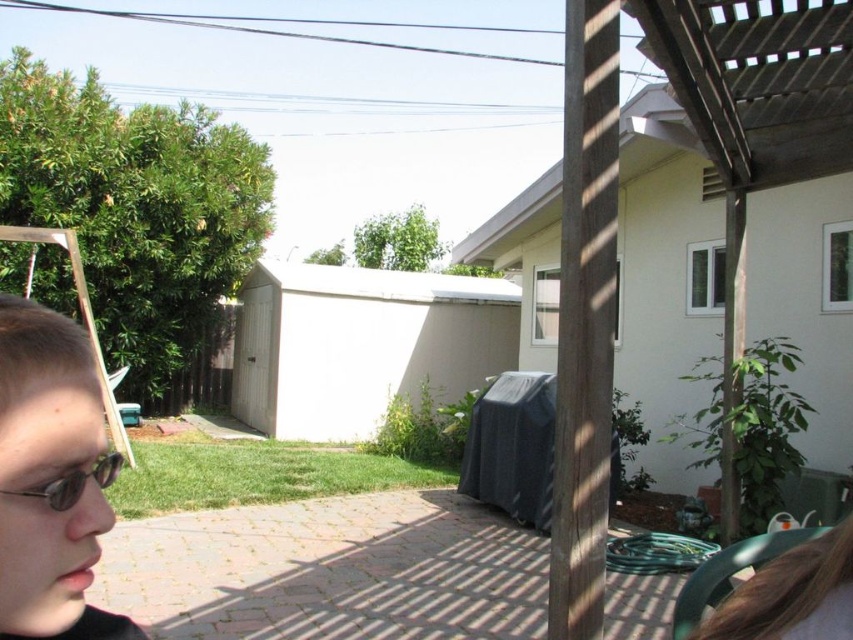
You are standing on the paved patio and want to pick up the light brown hair at lower left. In which direction should you move relative to your current position?

You should move to the lower left direction to pick up the light brown hair at lower left since it is located at point (x=51, y=477) which is in the lower left area of the image.

Please provide the 2D coordinates of the light brown hair at lower left in the image.

The light brown hair at lower left is located at coordinates point (51, 477).